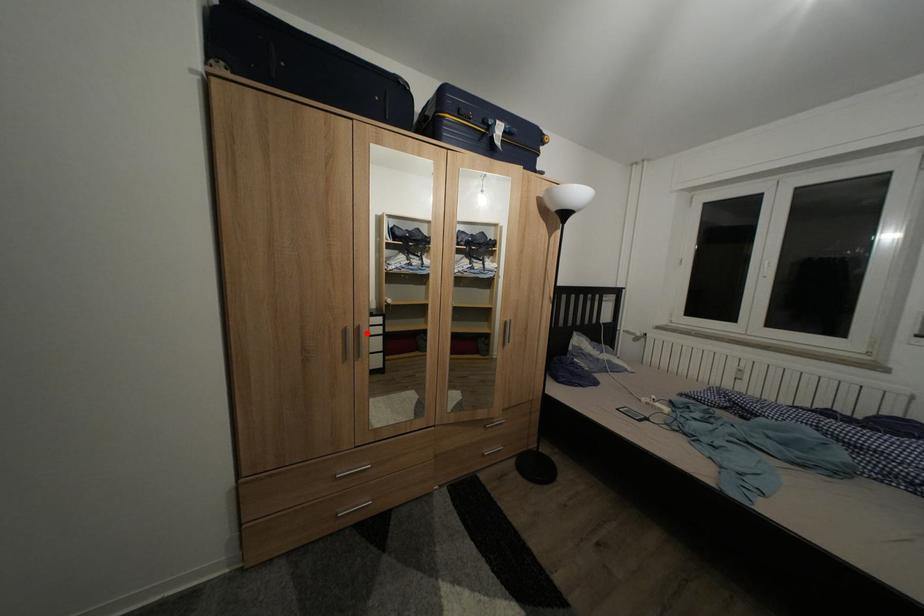
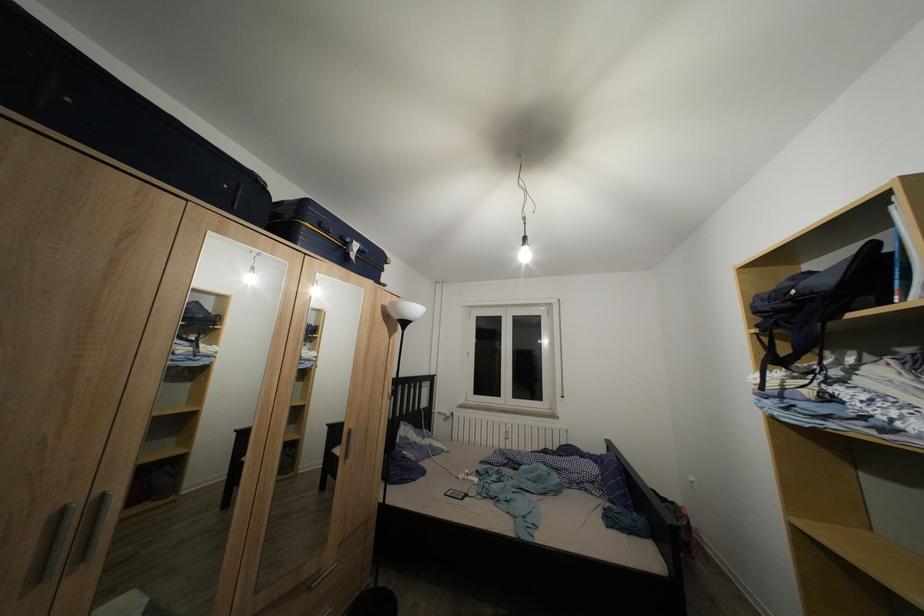
Find the pixel in the second image that matches the highlighted location in the first image.

(111, 503)